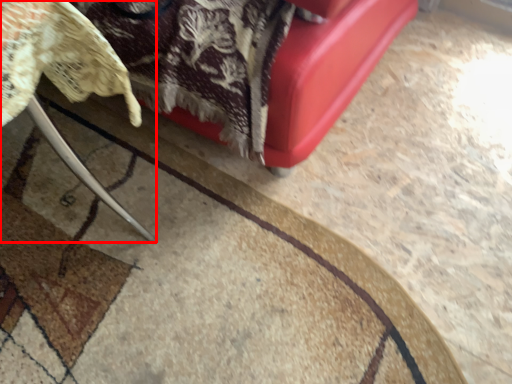
Question: Where is furniture (annotated by the red box) located in relation to mat in the image?

Choices:
 (A) right
 (B) left

Answer: (B)